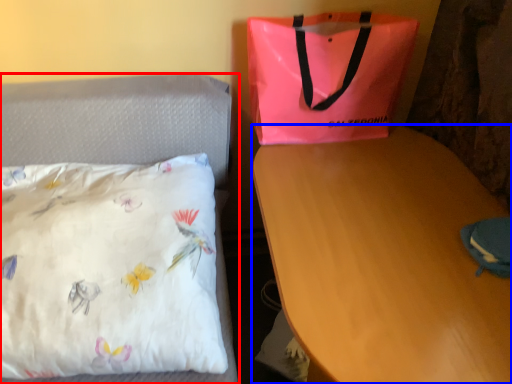
Question: Which point is further to the camera, bed (highlighted by a red box) or desk (highlighted by a blue box)?

Choices:
 (A) bed
 (B) desk

Answer: (B)